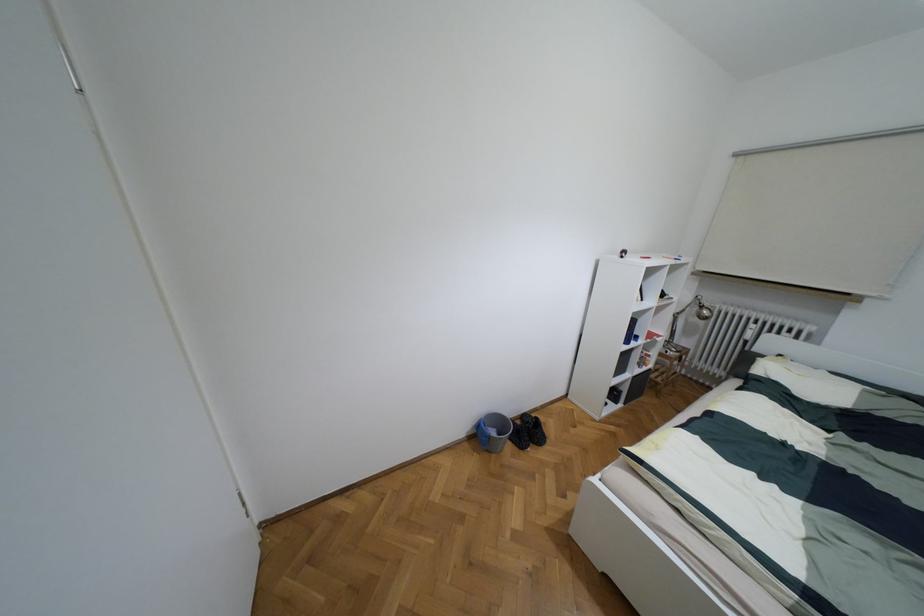
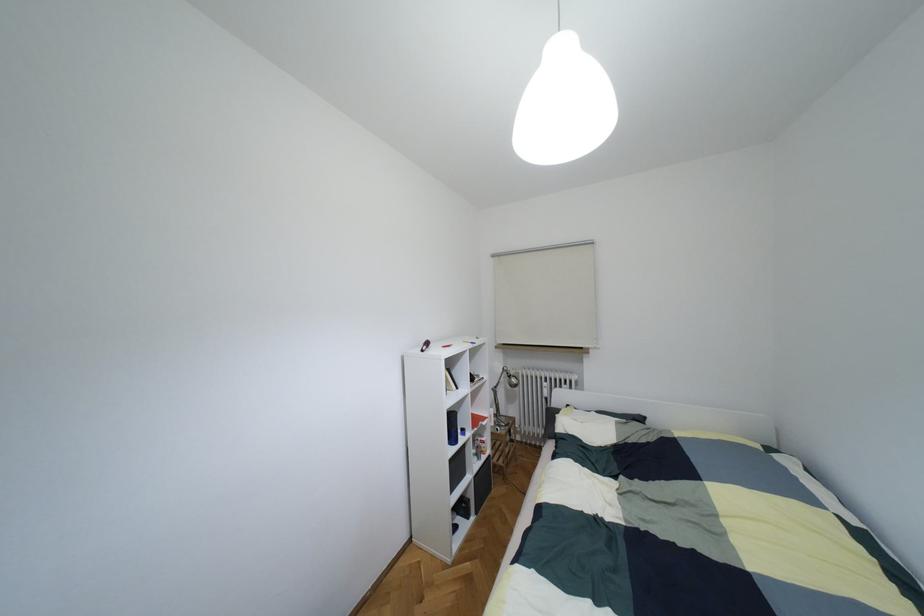
Question: The images are taken continuously from a first-person perspective. In which direction is your viewpoint rotating?

Choices:
 (A) Left
 (B) Right
 (C) Up
 (D) Down

Answer: (B)